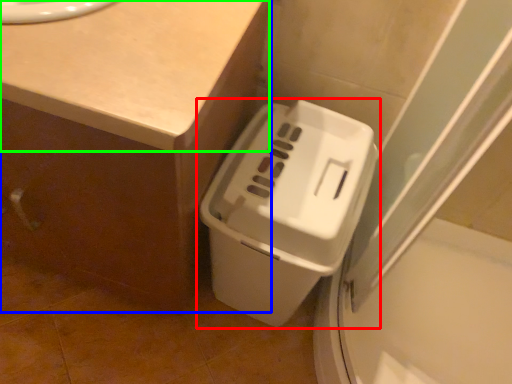
Question: Estimate the real-world distances between objects in this image. Which object is farther from waste container (highlighted by a red box), counter (highlighted by a blue box) or counter top (highlighted by a green box)?

Choices:
 (A) counter
 (B) counter top

Answer: (B)